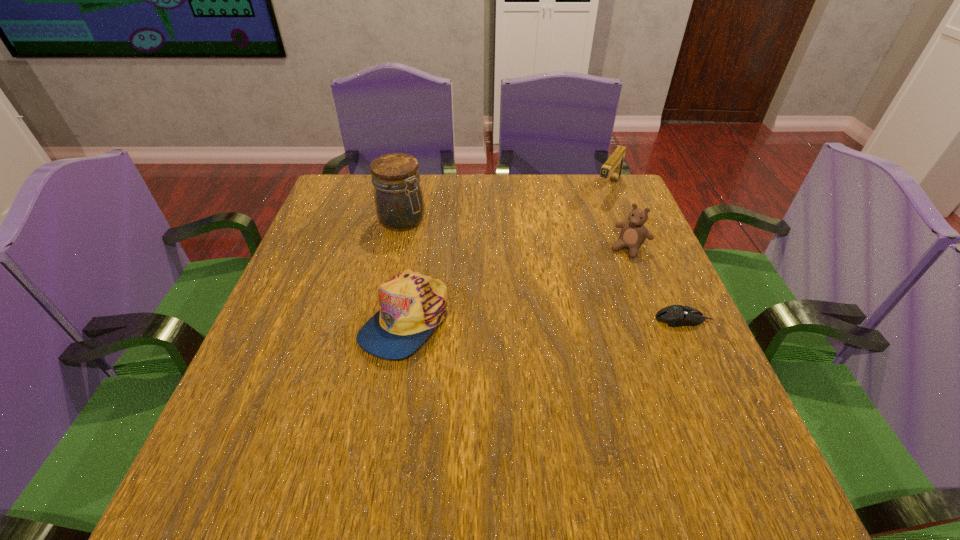
Locate an element on the screen. The height and width of the screenshot is (540, 960). blank area located 0.130m on the lid of the tallest object is located at coordinates (446, 254).

You are a GUI agent. You are given a task and a screenshot of the screen. Output one action in this format:
    pyautogui.click(x=<x>, y=<y>)
    Task: Click on the vacant space located on the front-facing side of the teddy bear
    This screenshot has width=960, height=540.
    Given the screenshot: What is the action you would take?
    pyautogui.click(x=605, y=280)

You are a GUI agent. You are given a task and a screenshot of the screen. Output one action in this format:
    pyautogui.click(x=<x>, y=<y>)
    Task: Click on the free space located on the front-facing side of the teddy bear
    
    Given the screenshot: What is the action you would take?
    pyautogui.click(x=575, y=320)

The image size is (960, 540). I want to click on vacant space located 0.340m on the front-facing side of the teddy bear, so click(x=554, y=347).

I want to click on vacant space located 0.270m at the barrel of the farthest object, so click(x=567, y=253).

Where is `vacant area situated 0.310m at the barrel of the farthest object`? The height and width of the screenshot is (540, 960). vacant area situated 0.310m at the barrel of the farthest object is located at coordinates (561, 262).

The width and height of the screenshot is (960, 540). In order to click on free region located at the barrel of the farthest object in this screenshot , I will do `click(595, 213)`.

In order to click on jar that is at the far edge in this screenshot , I will do `click(398, 197)`.

The image size is (960, 540). Find the location of `pistol that is at the far edge`. pistol that is at the far edge is located at coordinates (613, 166).

Find the location of a particular element. This screenshot has height=540, width=960. computer mouse at the right edge is located at coordinates (674, 315).